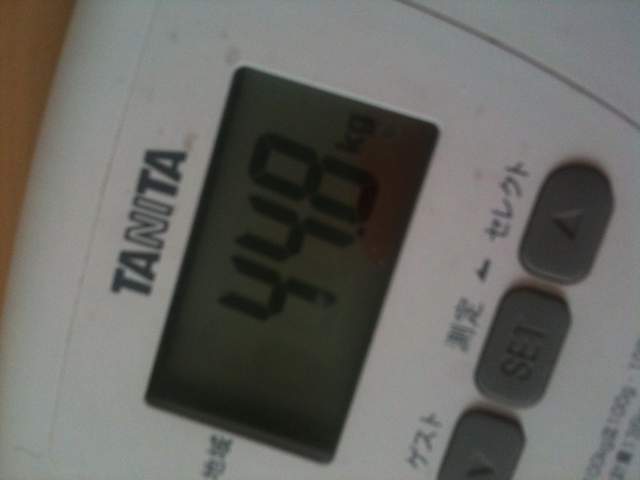
Locate an element on the screen. The image size is (640, 480). white casing of scale is located at coordinates (349, 51).